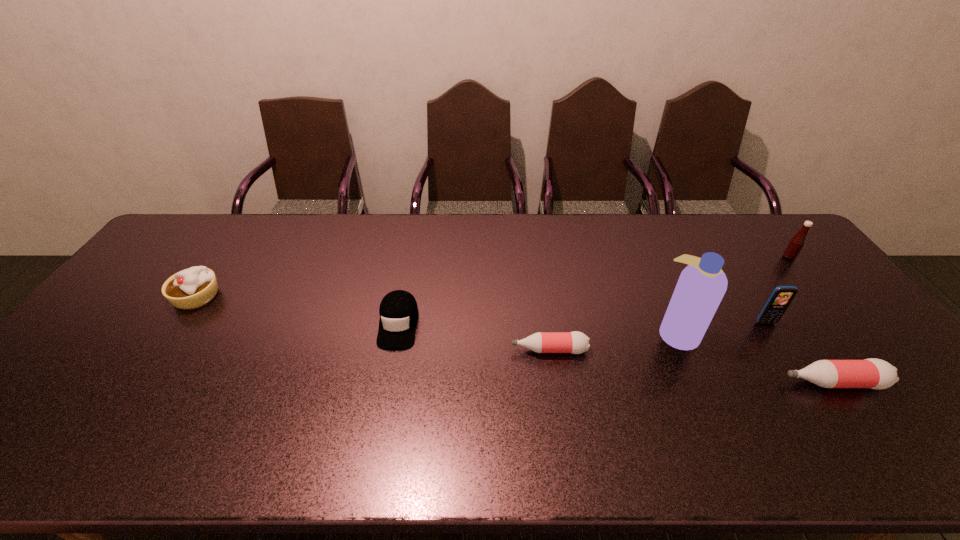
Where is `cellular telephone`? The image size is (960, 540). cellular telephone is located at coordinates (780, 298).

Where is `the second object from left to right`? Image resolution: width=960 pixels, height=540 pixels. the second object from left to right is located at coordinates (398, 311).

This screenshot has height=540, width=960. Identify the location of free space located with the cap open on the third object from left to right. (409, 350).

In order to click on free space located with the cap open on the third object from left to right in this screenshot , I will do `click(489, 350)`.

The width and height of the screenshot is (960, 540). I want to click on vacant space located with the cap open on the third object from left to right, so pos(417,350).

This screenshot has width=960, height=540. I want to click on vacant space located 0.150m with the cap open on the right bottle, so [x=721, y=383].

Image resolution: width=960 pixels, height=540 pixels. In order to click on vacant region located with the cap open on the right bottle in this screenshot , I will do `click(745, 383)`.

You are a GUI agent. You are given a task and a screenshot of the screen. Output one action in this format:
    pyautogui.click(x=<x>, y=<y>)
    Task: Click on the free region located 0.140m with the cap open on the right bottle
    This screenshot has width=960, height=540.
    Given the screenshot: What is the action you would take?
    pyautogui.click(x=725, y=383)

Find the location of a particular element. This screenshot has height=540, width=960. vacant space positioned on the back of the leftmost object is located at coordinates click(x=230, y=247).

Image resolution: width=960 pixels, height=540 pixels. Find the location of `free space located 0.270m on the left of the Tabasco sauce`. free space located 0.270m on the left of the Tabasco sauce is located at coordinates (701, 257).